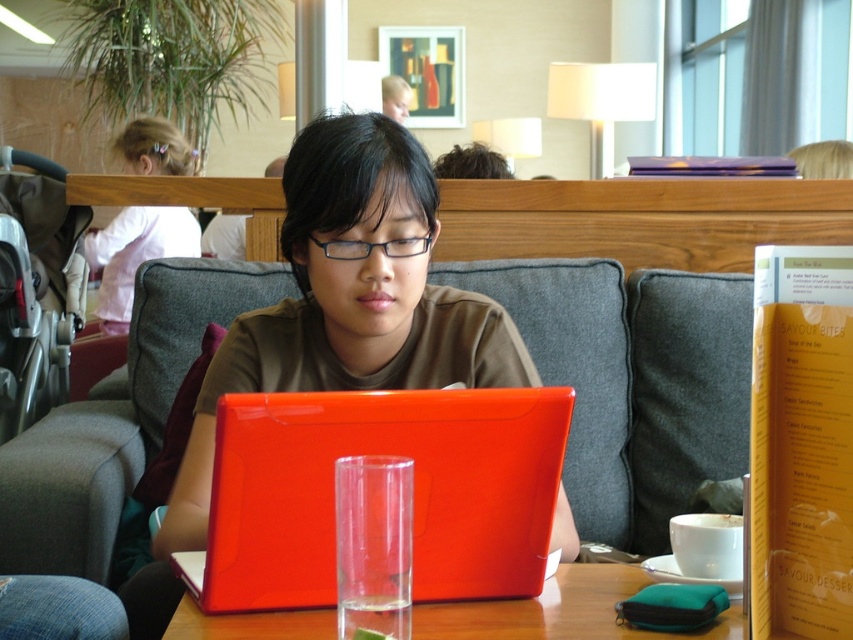
Question: Which is farther from the wooden table at center?

Choices:
 (A) transparent glass at center
 (B) black plastic glasses at center
 (C) matte plastic laptop at center

Answer: (B)

Question: Can you confirm if matte plastic laptop at center is thinner than transparent glass at center?

Choices:
 (A) yes
 (B) no

Answer: (B)

Question: Is pink fabric hairband at upper left wider than black plastic glasses at center?

Choices:
 (A) yes
 (B) no

Answer: (A)

Question: In this image, where is pink fabric hairband at upper left located relative to black plastic glasses at center?

Choices:
 (A) below
 (B) above

Answer: (B)

Question: Which of the following is the closest to the observer?

Choices:
 (A) pink fabric hairband at upper left
 (B) wooden table at center
 (C) black plastic glasses at center
 (D) glossy plastic laptop at center

Answer: (D)

Question: Which point is farther from the camera taking this photo?

Choices:
 (A) (172, 145)
 (B) (497, 314)
 (C) (277, 548)
 (D) (381, 605)

Answer: (A)